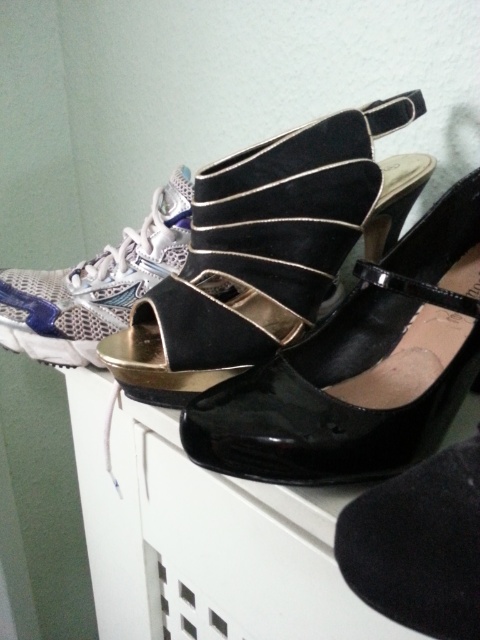
Question: Among these objects, which one is nearest to the camera?

Choices:
 (A) suede/leather sandal at center
 (B) shiny black sandal at center

Answer: (B)

Question: Which point is farther to the camera?

Choices:
 (A) (324, 417)
 (B) (226, 228)

Answer: (B)

Question: Is suede/leather sandal at center thinner than shiny black sandal at center?

Choices:
 (A) no
 (B) yes

Answer: (A)

Question: Is suede/leather sandal at center to the right of shiny black sandal at center from the viewer's perspective?

Choices:
 (A) no
 (B) yes

Answer: (A)

Question: Is suede/leather sandal at center positioned before shiny black sandal at center?

Choices:
 (A) no
 (B) yes

Answer: (A)

Question: Which point is farther to the camera?

Choices:
 (A) (272, 157)
 (B) (448, 211)

Answer: (B)